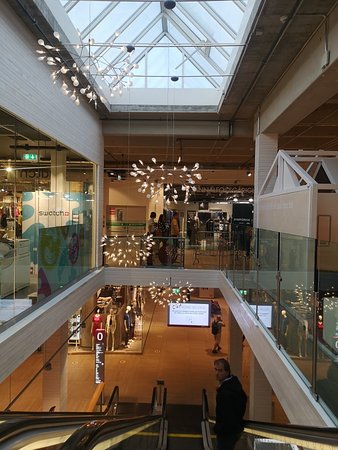
Where is `glass`? glass is located at coordinates (303, 336), (268, 277), (247, 266), (238, 262), (20, 282), (48, 270), (74, 263), (201, 261).